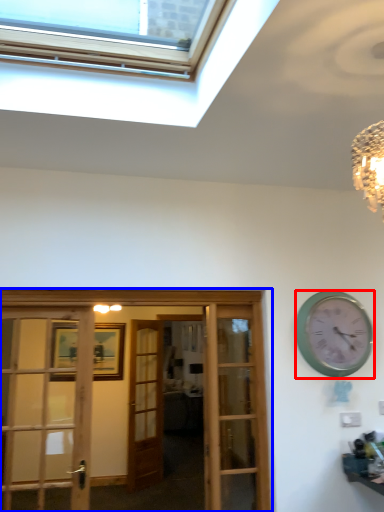
Question: Among these objects, which one is nearest to the camera, clock (highlighted by a red box) or hotel lobby (highlighted by a blue box)?

Choices:
 (A) clock
 (B) hotel lobby

Answer: (B)